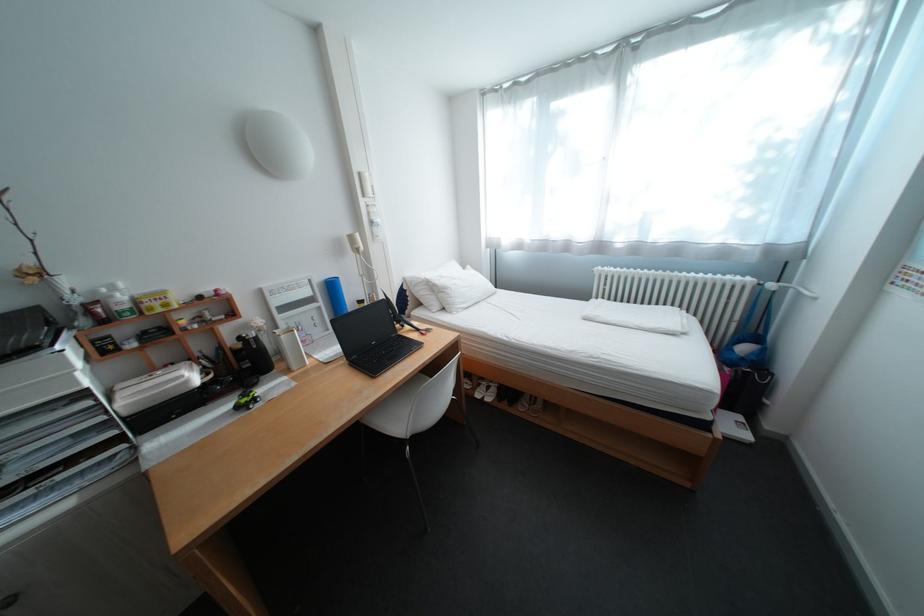
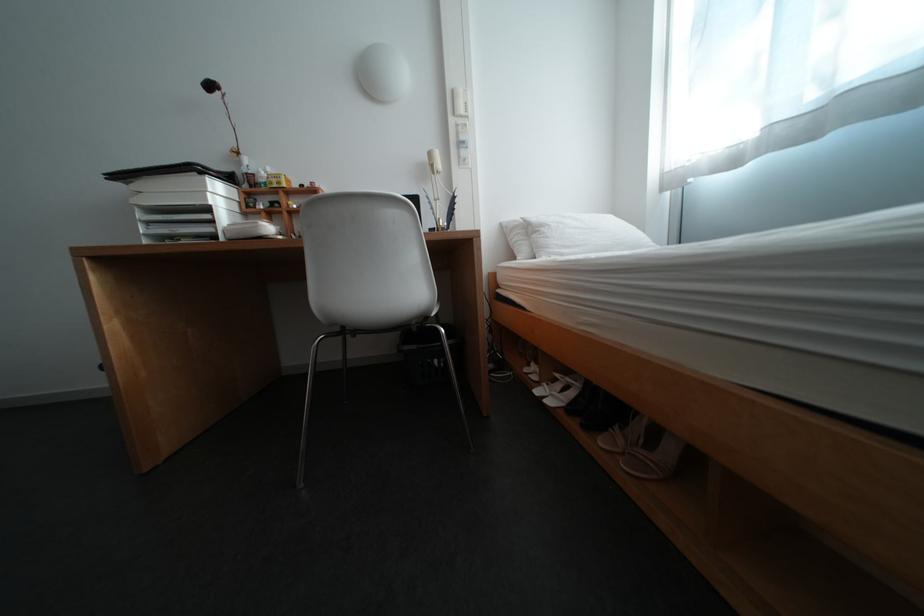
Locate, in the second image, the point that corresponds to the point at 195,378 in the first image.

(270, 224)